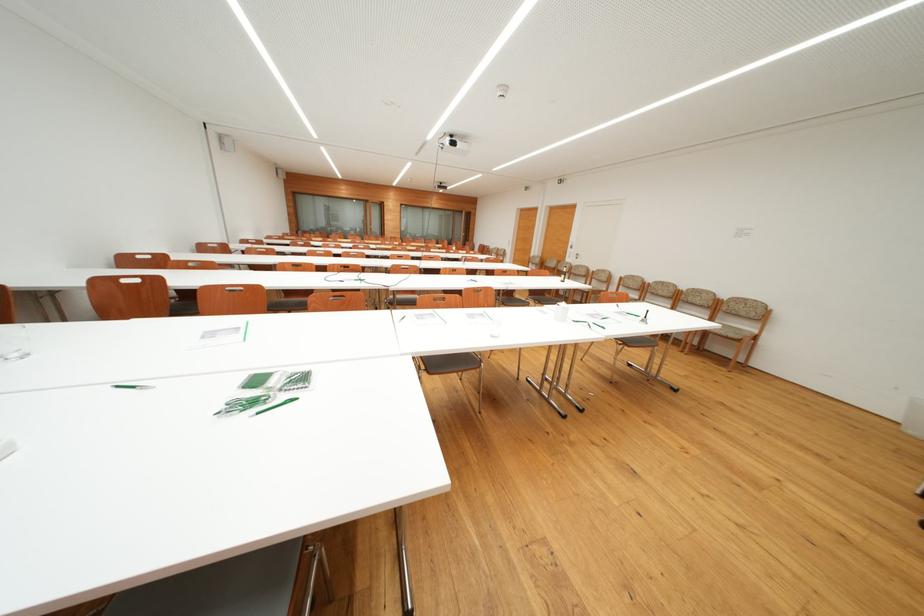
This screenshot has height=616, width=924. What do you see at coordinates (576, 254) in the screenshot?
I see `a white door handle` at bounding box center [576, 254].